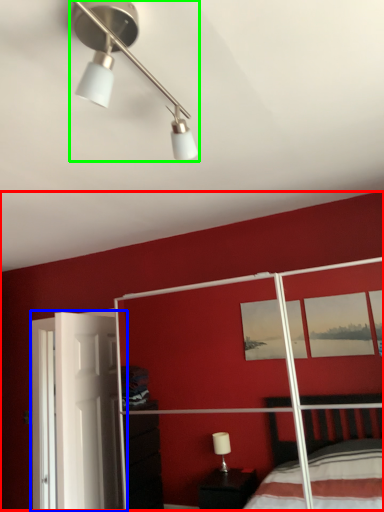
Question: Estimate the real-world distances between objects in this image. Which object is farther from backdrop (highlighted by a red box), screen door (highlighted by a blue box) or lamp (highlighted by a green box)?

Choices:
 (A) screen door
 (B) lamp

Answer: (B)